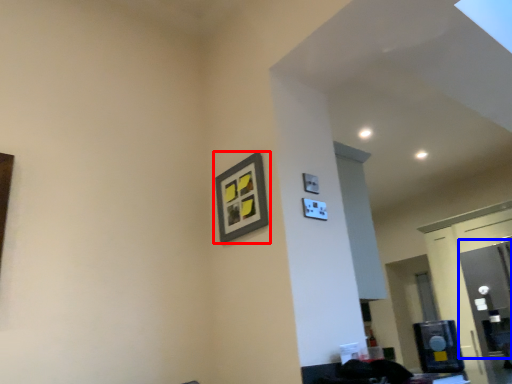
Question: Which object appears closest to the camera in this image, picture frame (highlighted by a red box) or glass door (highlighted by a blue box)?

Choices:
 (A) picture frame
 (B) glass door

Answer: (A)